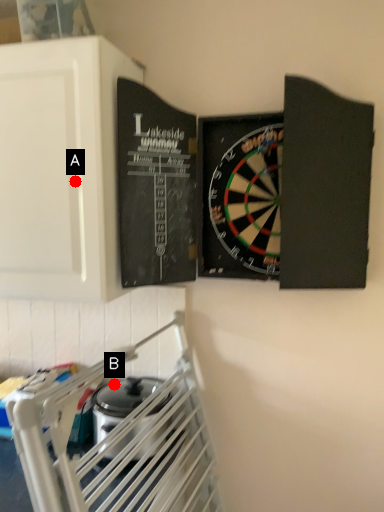
Question: Two points are circled on the image, labeled by A and B beside each circle. Which of the following is the farthest from the observer?

Choices:
 (A) A is further
 (B) B is further

Answer: (B)